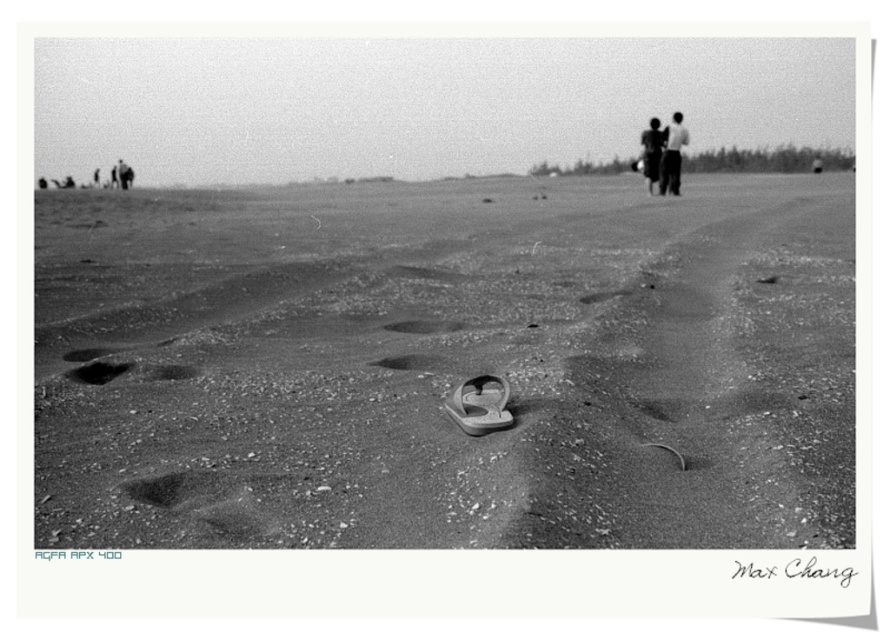
Can you confirm if gray rubber slipper at center is smaller than dark sand footprint at lower left?

No.

The width and height of the screenshot is (890, 640). What do you see at coordinates (480, 404) in the screenshot? I see `gray rubber slipper at center` at bounding box center [480, 404].

Does point (459, 401) come farther from viewer compared to point (111, 371)?

No.

Locate an element on the screen. gray rubber slipper at center is located at coordinates (480, 404).

Is gray rubber slipper at center closer to camera compared to dark fabric shirt at upper right?

Yes.

Which is behind, point (506, 406) or point (668, 186)?

The point (668, 186) is more distant.

What do you see at coordinates (480, 404) in the screenshot? I see `gray rubber slipper at center` at bounding box center [480, 404].

The image size is (890, 640). In order to click on gray rubber slipper at center in this screenshot , I will do `click(480, 404)`.

Does point (77, 371) come behind point (425, 324)?

No, (77, 371) is closer to viewer.

Identify the location of dark sand footprint at lower left. This screenshot has height=640, width=890. (98, 371).